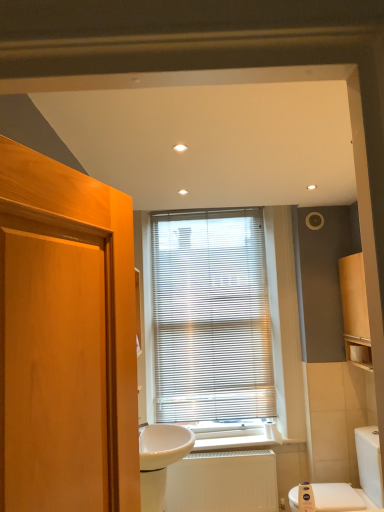
The width and height of the screenshot is (384, 512). What do you see at coordinates (160, 460) in the screenshot?
I see `white glossy sink at center` at bounding box center [160, 460].

In order to face white glossy sink at center, should I rotate leftwards or rightwards?

To face it directly, rotate left by 4.204 degrees.

Identify the location of white glossy toilet at lower right. (359, 477).

Measure the distance between metallic blinds at center and camera.

metallic blinds at center is 3.28 meters away from camera.

What is the approximate height of metallic blinds at center?

It is 1.72 meters.

The width and height of the screenshot is (384, 512). What do you see at coordinates (360, 353) in the screenshot?
I see `white matte toilet paper at right` at bounding box center [360, 353].

This screenshot has height=512, width=384. Identify the location of matte wood cabinet at right. (355, 310).

How many degrees apart are the facing directions of metallic blinds at center and white matte toilet paper at right?

The angular difference between metallic blinds at center and white matte toilet paper at right is 93.2 degrees.

Does metallic blinds at center appear on the left side of white matte toilet paper at right?

Yes, metallic blinds at center is to the left of white matte toilet paper at right.

Can you confirm if metallic blinds at center is taller than white matte toilet paper at right?

Yes.

You are a GUI agent. You are given a task and a screenshot of the screen. Output one action in this format:
    pyautogui.click(x=<x>, y=<y>)
    Task: Click on the toilet paper lying in front of the metallic blinds at center
    The width and height of the screenshot is (384, 512).
    Given the screenshot: What is the action you would take?
    pyautogui.click(x=360, y=353)

From the image's perspective, is matte wood cabinet at right positioned above or below white textured radiator at lower center?

matte wood cabinet at right is above white textured radiator at lower center.

Based on their positions, is matte wood cabinet at right located to the left or right of white textured radiator at lower center?

Based on their positions, matte wood cabinet at right is located to the right of white textured radiator at lower center.

Where is `cabinetry in front of the white textured radiator at lower center`? This screenshot has height=512, width=384. cabinetry in front of the white textured radiator at lower center is located at coordinates (355, 310).

Does point (350, 345) come behind point (177, 499)?

Yes, it is behind point (177, 499).

Measure the distance between white matte toilet paper at right and white glossy toilet at lower right.

white matte toilet paper at right is 26.70 inches from white glossy toilet at lower right.

From the image's perspective, does white matte toilet paper at right appear higher than white glossy toilet at lower right?

Yes, from the image's perspective, white matte toilet paper at right is over white glossy toilet at lower right.

Can you confirm if white matte toilet paper at right is shorter than white glossy toilet at lower right?

Yes.

Choose the correct answer: Is white matte toilet paper at right inside white glossy toilet at lower right or outside it?

white matte toilet paper at right is spatially situated outside white glossy toilet at lower right.

Does point (248, 383) appear closer or farther from the camera than point (365, 490)?

Point (248, 383).

Can you confirm if metallic blinds at center is positioned to the right of white glossy toilet at lower right?

Incorrect, metallic blinds at center is not on the right side of white glossy toilet at lower right.

Would you say metallic blinds at center is inside or outside white glossy toilet at lower right?

metallic blinds at center exists outside the volume of white glossy toilet at lower right.

Is metallic blinds at center facing towards white glossy toilet at lower right?

No, metallic blinds at center is not oriented towards white glossy toilet at lower right.

Where is `cabinetry on the right of white glossy sink at center`? cabinetry on the right of white glossy sink at center is located at coordinates (355, 310).

Which is more to the left, white glossy sink at center or matte wood cabinet at right?

white glossy sink at center is more to the left.

Is point (141, 431) more distant than point (347, 303)?

No, it is in front of (347, 303).

Would you say white glossy sink at center is a long distance from matte wood cabinet at right?

white glossy sink at center is positioned a significant distance from matte wood cabinet at right.

This screenshot has height=512, width=384. I want to click on toilet paper behind the white glossy sink at center, so click(x=360, y=353).

Which is behind, point (361, 356) or point (162, 479)?

The point (361, 356) is more distant.

From a real-world perspective, who is located lower, white matte toilet paper at right or white glossy sink at center?

white glossy sink at center, from a real-world perspective.

From the picture: In the image, is matte wood cabinet at right on the left side or the right side of white matte toilet paper at right?

matte wood cabinet at right is positioned on white matte toilet paper at right's left side.

Is point (354, 347) positioned after point (355, 344)?

Yes.

From the image's perspective, between matte wood cabinet at right and white matte toilet paper at right, who is located below?

white matte toilet paper at right is shown below in the image.

Locate an element on the screen. toilet paper below the metallic blinds at center (from a real-world perspective) is located at coordinates (360, 353).

Identify the location of radiator on the left of matte wood cabinet at right. This screenshot has width=384, height=512. (223, 482).

Considering their positions, is white glossy sink at center positioned further to white matte toilet paper at right than metallic blinds at center?

Among the two, white glossy sink at center is located further to white matte toilet paper at right.

Based on their spatial positions, is metallic blinds at center or white glossy sink at center further from matte wood cabinet at right?

white glossy sink at center is further to matte wood cabinet at right.

Based on their spatial positions, is white glossy sink at center or white textured radiator at lower center further from white matte toilet paper at right?

white glossy sink at center is further to white matte toilet paper at right.

Estimate the real-world distances between objects in this image. Which object is further from white textured radiator at lower center, metallic blinds at center or white matte toilet paper at right?

white matte toilet paper at right is positioned further to the anchor white textured radiator at lower center.

Which object lies further to the anchor point white glossy sink at center, matte wood cabinet at right or white matte toilet paper at right?

The object further to white glossy sink at center is white matte toilet paper at right.

Which object lies nearer to the anchor point matte wood cabinet at right, white textured radiator at lower center or white glossy toilet at lower right?

Based on the image, white glossy toilet at lower right appears to be nearer to matte wood cabinet at right.

When comparing their distances from matte wood cabinet at right, does white glossy sink at center or white glossy toilet at lower right seem further?

white glossy sink at center is positioned further to the anchor matte wood cabinet at right.

Looking at this image, estimate the real-world distances between objects in this image. Which object is closer to white glossy toilet at lower right, white matte toilet paper at right or matte wood cabinet at right?

white matte toilet paper at right is closer to white glossy toilet at lower right.

Identify the location of toilet paper between metallic blinds at center and white textured radiator at lower center vertically. (360, 353).

The image size is (384, 512). In order to click on toilet between metallic blinds at center and white matte toilet paper at right in this screenshot , I will do `click(359, 477)`.

I want to click on toilet between metallic blinds at center and white textured radiator at lower center in the up-down direction, so click(x=359, y=477).

This screenshot has height=512, width=384. I want to click on toilet situated between white glossy sink at center and matte wood cabinet at right from left to right, so click(x=359, y=477).